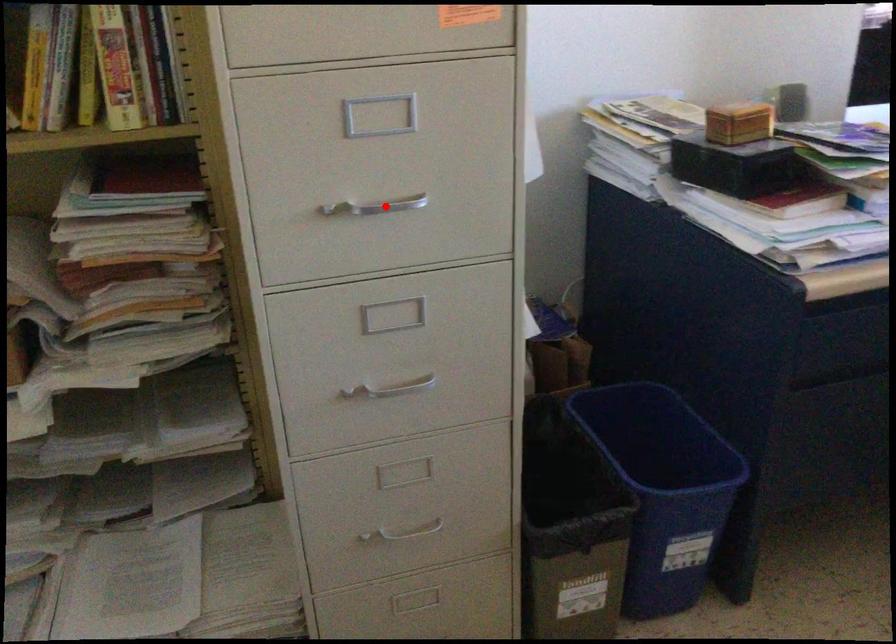
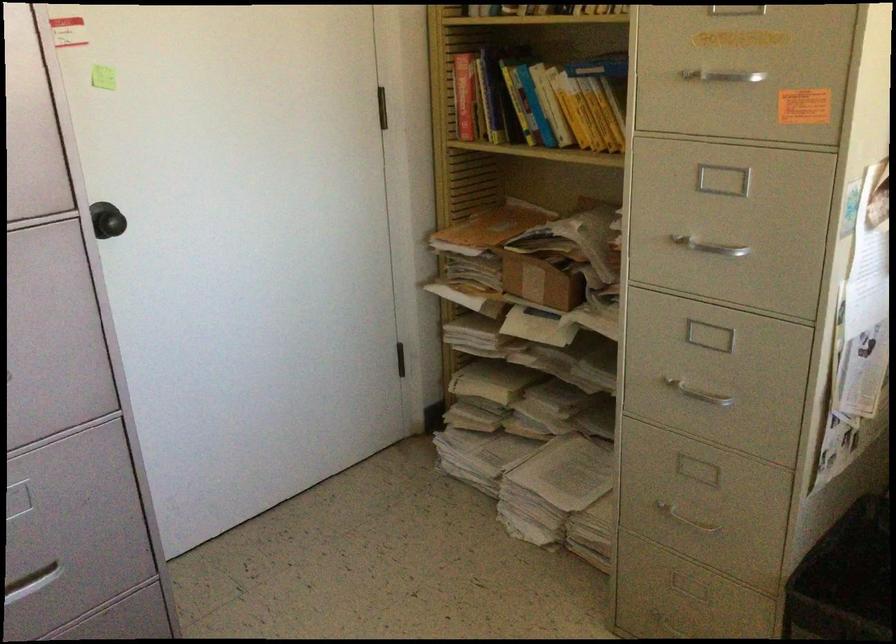
Where in the second image is the point corresponding to the highlighted location from the first image?

(710, 248)